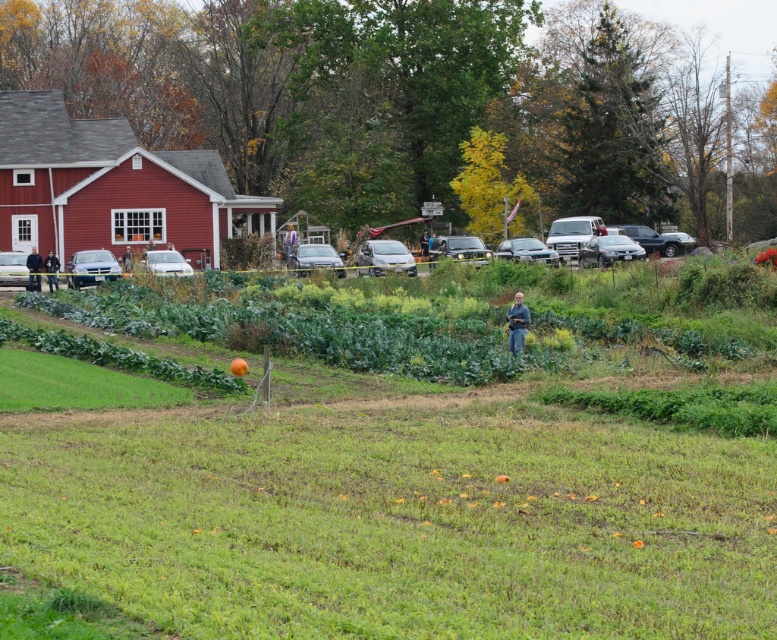
Question: Which object is the closest to the blue jeans at left?

Choices:
 (A) blue jeans at center
 (B) green grassy field at center
 (C) dark blue jeans at center

Answer: (C)

Question: Is green grassy field at center bigger than blue jeans at center?

Choices:
 (A) no
 (B) yes

Answer: (B)

Question: Considering the real-world distances, which object is closest to the blue jeans at center?

Choices:
 (A) blue jeans at left
 (B) dark blue jeans at center
 (C) green grassy field at center

Answer: (C)

Question: Can you confirm if green grassy field at center is bigger than dark blue jeans at center?

Choices:
 (A) no
 (B) yes

Answer: (B)

Question: Which point is closer to the camera?

Choices:
 (A) blue jeans at left
 (B) dark blue jeans at center
 (C) blue jeans at center
 (D) green grassy field at center

Answer: (D)

Question: Can you confirm if green grassy field at center is positioned above dark blue jeans at center?

Choices:
 (A) yes
 (B) no

Answer: (B)